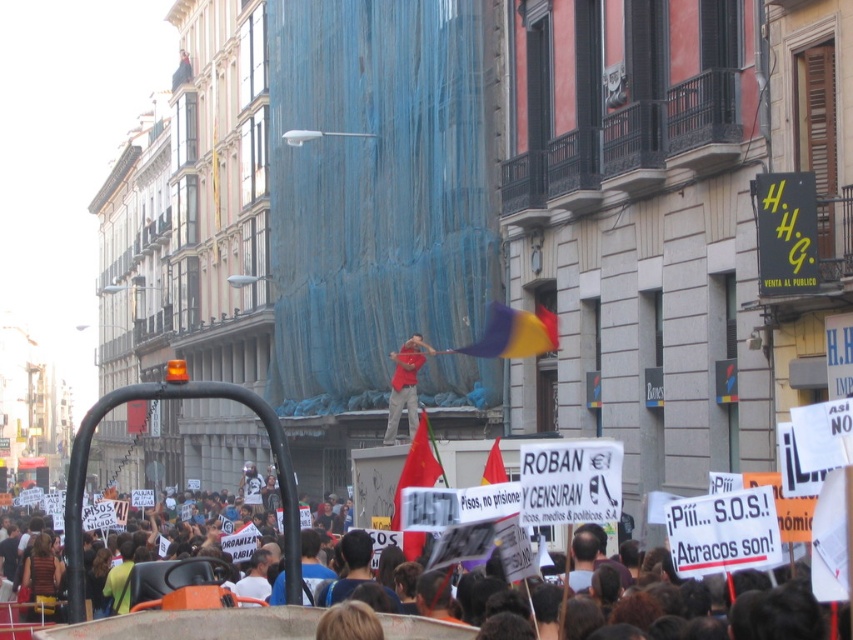
Consider the image. You are a photographer at the protest and want to capture both the red flag at center and the red cotton shirt at center in the same frame. Which object should you focus on to ensure both are visible without zooming in or out?

The red flag at center is wider than the red cotton shirt at center, so focusing on the red flag at center will ensure both objects are visible in the frame without needing to adjust the zoom.